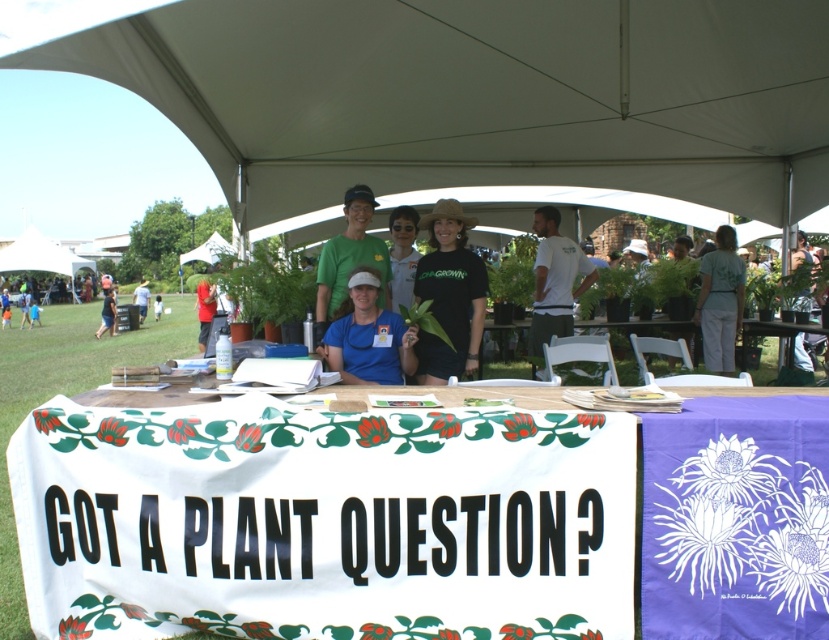
Is white fabric at center thinner than matte black shirt at center?

No, white fabric at center is not thinner than matte black shirt at center.

Looking at this image, can you confirm if white fabric at center is positioned to the left of matte black shirt at center?

No, white fabric at center is not to the left of matte black shirt at center.

Image resolution: width=829 pixels, height=640 pixels. Describe the element at coordinates (323, 520) in the screenshot. I see `white fabric at center` at that location.

Identify the location of white fabric at center. The height and width of the screenshot is (640, 829). (323, 520).

Which of these two, blue fabric shirt at center or green fabric shirt at center, stands shorter?

blue fabric shirt at center is shorter.

Is point (371, 294) positioned before point (718, 298)?

Yes, point (371, 294) is closer to viewer.

What do you see at coordinates (367, 337) in the screenshot?
I see `blue fabric shirt at center` at bounding box center [367, 337].

Find the location of a particular element. The height and width of the screenshot is (640, 829). blue fabric shirt at center is located at coordinates (367, 337).

Does point (537, 93) come in front of point (154, 316)?

Yes, point (537, 93) is in front of point (154, 316).

Find the location of a particular element. Image resolution: width=829 pixels, height=640 pixels. white fabric canopy at upper center is located at coordinates click(480, 96).